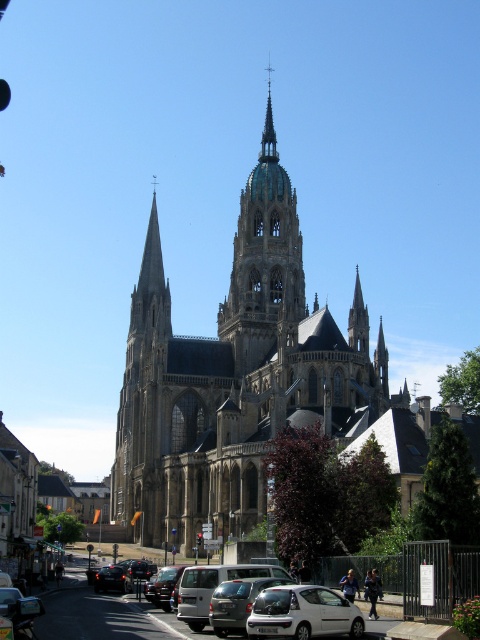
Question: Does metallic silver van at center appear on the right side of smooth gray spire at center?

Choices:
 (A) yes
 (B) no

Answer: (B)

Question: Estimate the real-world distances between objects in this image. Which object is farther from the brown stone church at center?

Choices:
 (A) smooth gray spire at center
 (B) golden stone spire at center
 (C) metallic silver van at center
 (D) silver metallic car at lower center

Answer: (C)

Question: Which is nearer to the metallic silver van at center?

Choices:
 (A) golden stone spire at center
 (B) white matte hatchback at center
 (C) smooth gray spire at center

Answer: (B)

Question: Can you confirm if golden stone spire at center is bigger than silver metallic car at lower center?

Choices:
 (A) yes
 (B) no

Answer: (A)

Question: Is the position of golden stone spire at center more distant than that of smooth gray spire at center?

Choices:
 (A) no
 (B) yes

Answer: (B)

Question: Which of the following is the farthest from the observer?

Choices:
 (A) smooth gray spire at center
 (B) silver metallic car at lower center
 (C) brown stone church at center

Answer: (A)